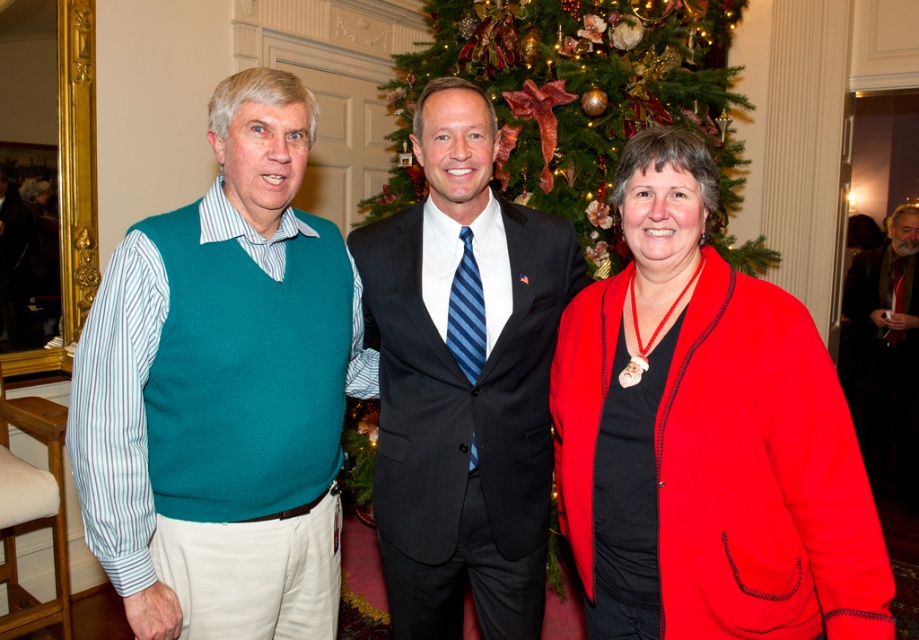
Does teal sweater vest at center appear over dark gray suit at center?

Yes.

In the scene shown: How much distance is there between teal sweater vest at center and dark gray suit at center?

12.59 inches

Which is in front, point (119, 579) or point (396, 561)?

Positioned in front is point (119, 579).

Where is `teal sweater vest at center`? The width and height of the screenshot is (919, 640). teal sweater vest at center is located at coordinates (223, 390).

Which of these two, green textured christmas tree at center or dark brown leather jacket at center, stands taller?

With more height is dark brown leather jacket at center.

Based on the photo, measure the distance between green textured christmas tree at center and camera.

green textured christmas tree at center is 8.36 feet from camera.

This screenshot has height=640, width=919. In order to click on green textured christmas tree at center in this screenshot , I will do [x=579, y=104].

Image resolution: width=919 pixels, height=640 pixels. In order to click on green textured christmas tree at center in this screenshot , I will do `click(579, 104)`.

Is matte red jacket at center positioned at the back of dark gray suit at center?

No, matte red jacket at center is closer to the viewer.

Does point (653, 406) come behind point (425, 381)?

No, it is in front of (425, 381).

Locate an element on the screen. matte red jacket at center is located at coordinates (706, 436).